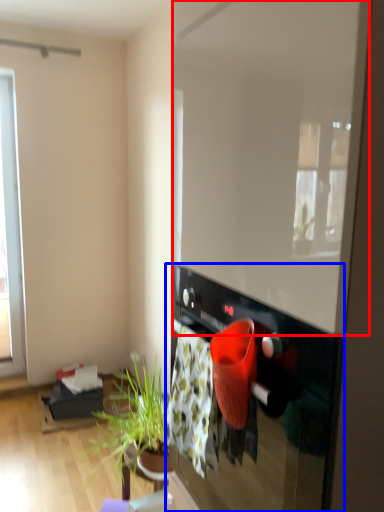
Question: Which object appears closest to the camera in this image, window screen (highlighted by a red box) or oven (highlighted by a blue box)?

Choices:
 (A) window screen
 (B) oven

Answer: (A)